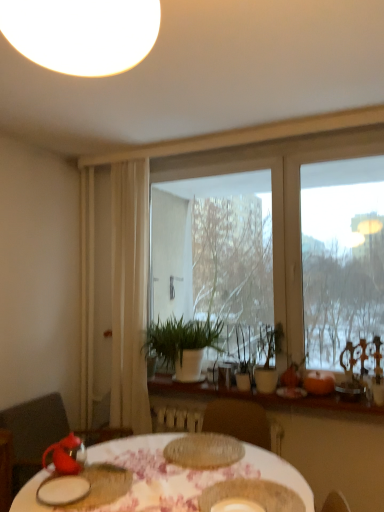
Find the location of a particular element. Image resolution: width=384 pixels, height=512 pixels. free space between matte ceramic bowl at center, which is the 7th tableware from left to right, and matte red teapot at lower left, which is the 10th tableware in right-to-left order is located at coordinates (147, 485).